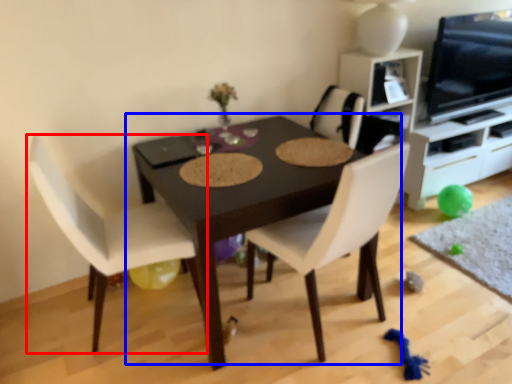
Question: Which object is closer to the camera taking this photo, chair (highlighted by a red box) or table (highlighted by a blue box)?

Choices:
 (A) chair
 (B) table

Answer: (A)